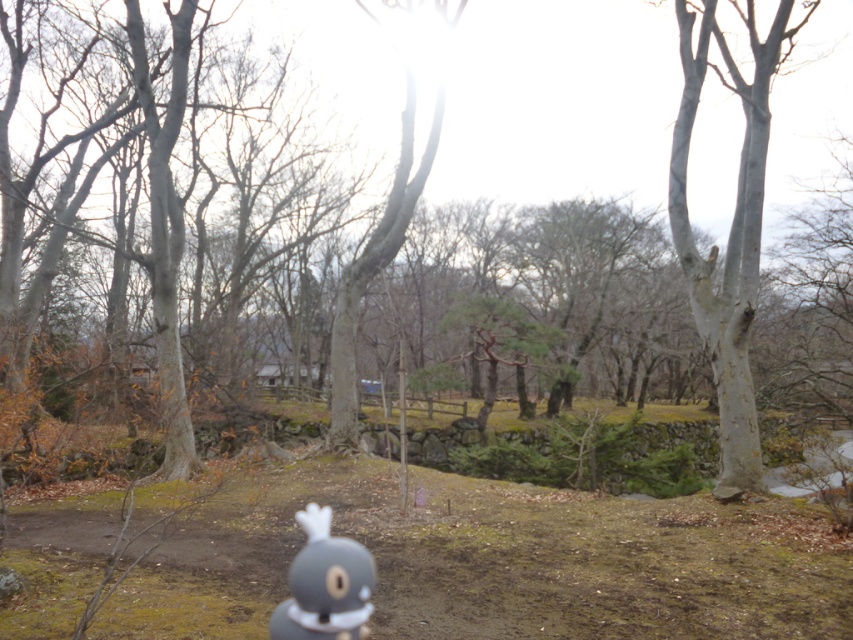
Question: Does smooth gray bark at center appear on the right side of gray matte plush toy at lower center?

Choices:
 (A) no
 (B) yes

Answer: (B)

Question: Among these objects, which one is farthest from the camera?

Choices:
 (A) smooth gray bark at center
 (B) gray matte plush toy at lower center

Answer: (A)

Question: Among these objects, which one is nearest to the camera?

Choices:
 (A) gray matte plush toy at lower center
 (B) smooth gray bark at center

Answer: (A)

Question: Is smooth gray bark at center positioned in front of gray matte plush toy at lower center?

Choices:
 (A) yes
 (B) no

Answer: (B)

Question: Can you confirm if smooth gray bark at center is thinner than gray matte plush toy at lower center?

Choices:
 (A) no
 (B) yes

Answer: (A)